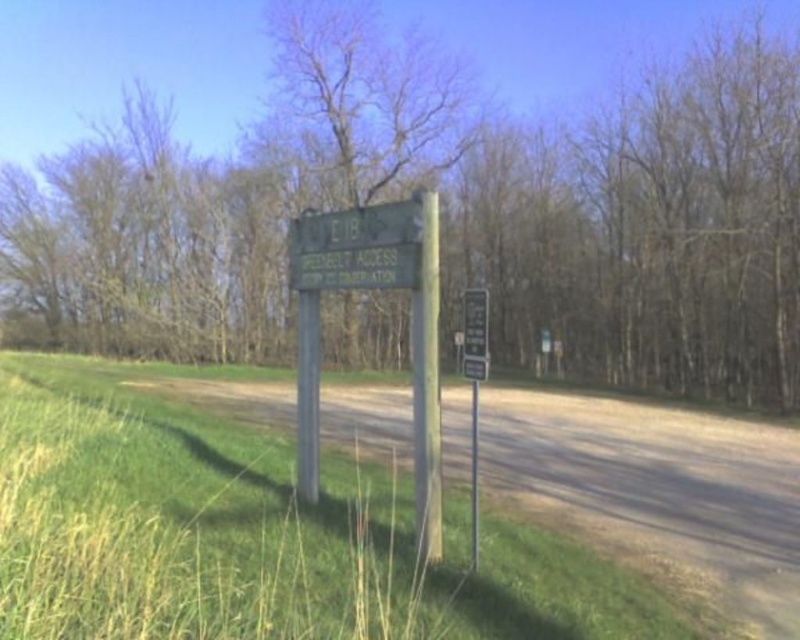
Between green wooden sign at center and gray wood pole at center, which one appears on the right side from the viewer's perspective?

From the viewer's perspective, green wooden sign at center appears more on the right side.

Looking at this image, can you confirm if green wooden sign at center is taller than gray wood pole at center?

Yes, green wooden sign at center is taller than gray wood pole at center.

Between point (417, 276) and point (297, 356), which one is positioned in front?

Positioned in front is point (417, 276).

At what (x,y) coordinates should I click in order to perform the action: click on green wooden sign at center. Please return your answer as a coordinate pair (x, y). Looking at the image, I should click on (374, 288).

Between green matte sign at center and green painted wood pole at center, which one appears on the right side from the viewer's perspective?

Positioned to the right is green painted wood pole at center.

Which is more to the left, green matte sign at center or green painted wood pole at center?

green matte sign at center

Which is behind, point (314, 260) or point (418, 300)?

The point (314, 260) is more distant.

The width and height of the screenshot is (800, 640). Identify the location of green matte sign at center. (358, 248).

Is green grass at lower left positioned in front of green painted wood pole at center?

Yes, green grass at lower left is closer to the viewer.

Between green grass at lower left and green painted wood pole at center, which one has more height?

With more height is green painted wood pole at center.

Locate an element on the screen. The width and height of the screenshot is (800, 640). green grass at lower left is located at coordinates (254, 532).

Where is `green grass at lower left`? green grass at lower left is located at coordinates (254, 532).